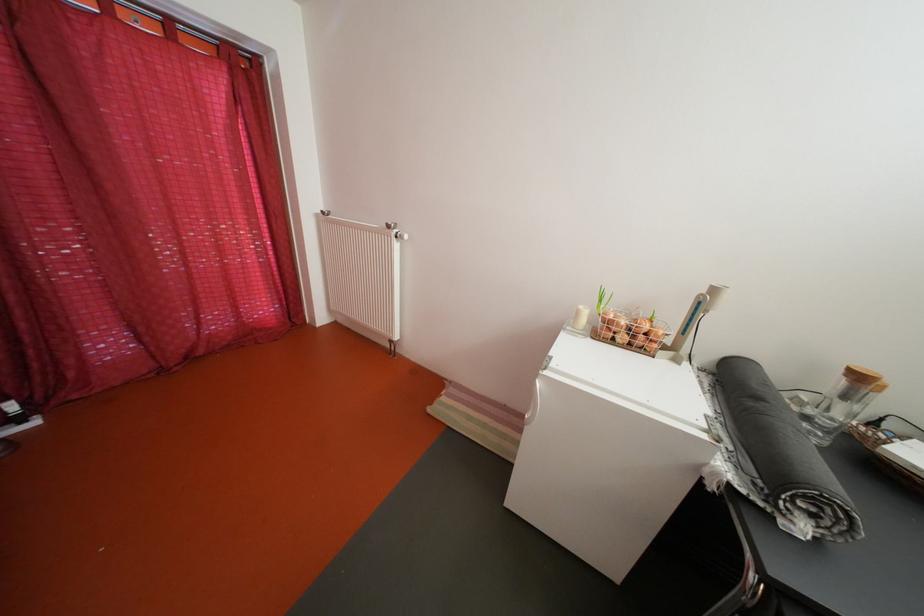
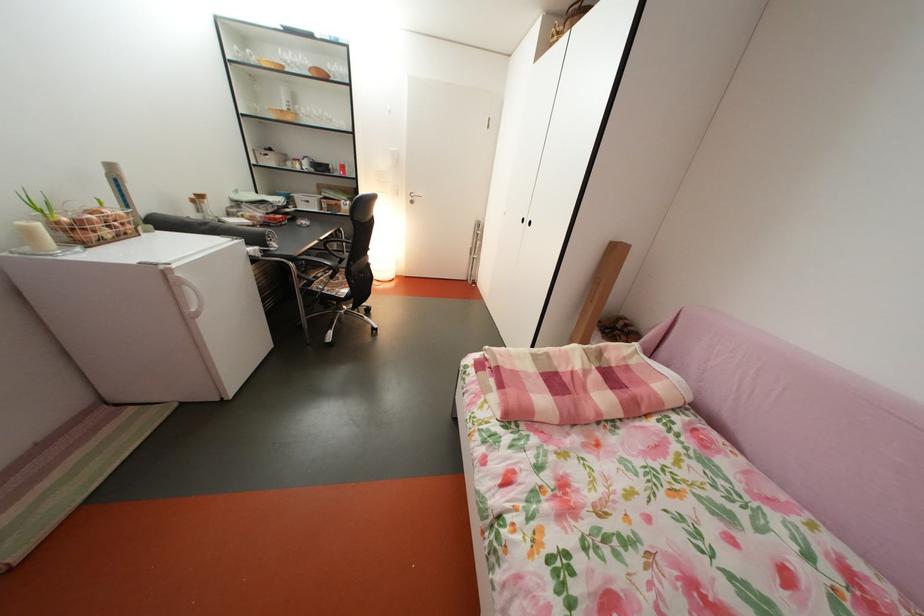
Find the pixel in the second image that matches point 589,318 in the first image.

(41, 238)